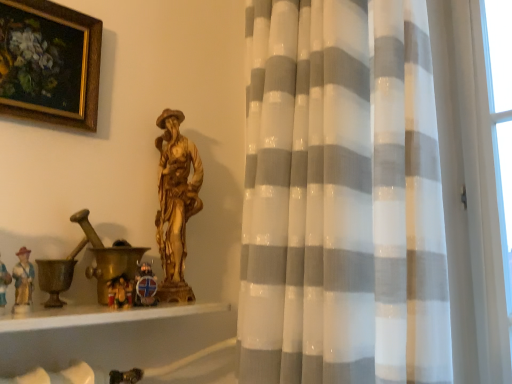
Question: Does white sheer curtain at center come behind white glossy wood at lower left?

Choices:
 (A) yes
 (B) no

Answer: (B)

Question: Is white sheer curtain at center next to white glossy wood at lower left?

Choices:
 (A) no
 (B) yes

Answer: (A)

Question: Can you confirm if white sheer curtain at center is wider than white glossy wood at lower left?

Choices:
 (A) no
 (B) yes

Answer: (B)

Question: Is white glossy wood at lower left inside white sheer curtain at center?

Choices:
 (A) yes
 (B) no

Answer: (B)

Question: Is white sheer curtain at center thinner than white glossy wood at lower left?

Choices:
 (A) no
 (B) yes

Answer: (A)

Question: From a real-world perspective, does white sheer curtain at center stand above white glossy wood at lower left?

Choices:
 (A) no
 (B) yes

Answer: (B)

Question: Is gold-framed painting at upper left smaller than white sheer curtain at center?

Choices:
 (A) no
 (B) yes

Answer: (B)

Question: Is white sheer curtain at center a part of gold-framed painting at upper left?

Choices:
 (A) yes
 (B) no

Answer: (B)

Question: From a real-world perspective, does gold-framed painting at upper left stand above white sheer curtain at center?

Choices:
 (A) yes
 (B) no

Answer: (A)

Question: Is gold-framed painting at upper left shorter than white sheer curtain at center?

Choices:
 (A) no
 (B) yes

Answer: (B)

Question: Is gold-framed painting at upper left with white sheer curtain at center?

Choices:
 (A) yes
 (B) no

Answer: (B)

Question: Considering the relative sizes of gold-framed painting at upper left and white sheer curtain at center in the image provided, is gold-framed painting at upper left bigger than white sheer curtain at center?

Choices:
 (A) yes
 (B) no

Answer: (B)

Question: Could you tell me if white sheer curtain at center is facing gold-framed painting at upper left?

Choices:
 (A) no
 (B) yes

Answer: (A)